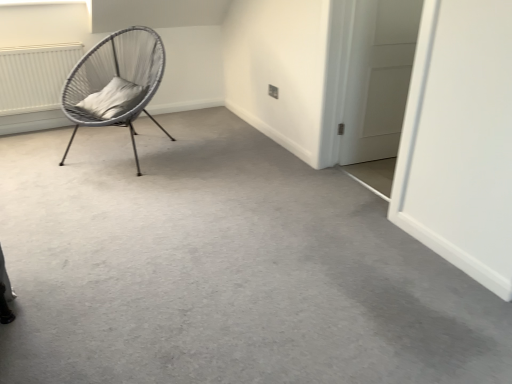
Question: Is white matte door at right positioned with its back to gray carpet at center?

Choices:
 (A) no
 (B) yes

Answer: (A)

Question: Is white matte door at right thinner than gray carpet at center?

Choices:
 (A) no
 (B) yes

Answer: (B)

Question: Can you confirm if white matte door at right is bigger than gray carpet at center?

Choices:
 (A) no
 (B) yes

Answer: (A)

Question: Is white matte door at right behind gray carpet at center?

Choices:
 (A) yes
 (B) no

Answer: (A)

Question: Can gray carpet at center be found inside white matte door at right?

Choices:
 (A) no
 (B) yes

Answer: (A)

Question: From the image's perspective, is white soft cushion at left positioned above or below gray carpet at center?

Choices:
 (A) above
 (B) below

Answer: (A)

Question: Is white soft cushion at left taller or shorter than gray carpet at center?

Choices:
 (A) short
 (B) tall

Answer: (B)

Question: In terms of size, does white soft cushion at left appear bigger or smaller than gray carpet at center?

Choices:
 (A) big
 (B) small

Answer: (B)

Question: In terms of width, does white soft cushion at left look wider or thinner when compared to gray carpet at center?

Choices:
 (A) wide
 (B) thin

Answer: (B)

Question: From the image's perspective, is woven grey chair at left located above or below gray carpet at center?

Choices:
 (A) above
 (B) below

Answer: (A)

Question: Is woven grey chair at left taller or shorter than gray carpet at center?

Choices:
 (A) short
 (B) tall

Answer: (B)

Question: Is point (152, 34) closer or farther from the camera than point (208, 140)?

Choices:
 (A) closer
 (B) farther

Answer: (A)

Question: Would you say woven grey chair at left is inside or outside gray carpet at center?

Choices:
 (A) outside
 (B) inside

Answer: (A)

Question: Considering the positions of gray carpet at center and woven grey chair at left in the image, is gray carpet at center wider or thinner than woven grey chair at left?

Choices:
 (A) wide
 (B) thin

Answer: (A)

Question: Is point (42, 165) closer or farther from the camera than point (131, 79)?

Choices:
 (A) closer
 (B) farther

Answer: (A)